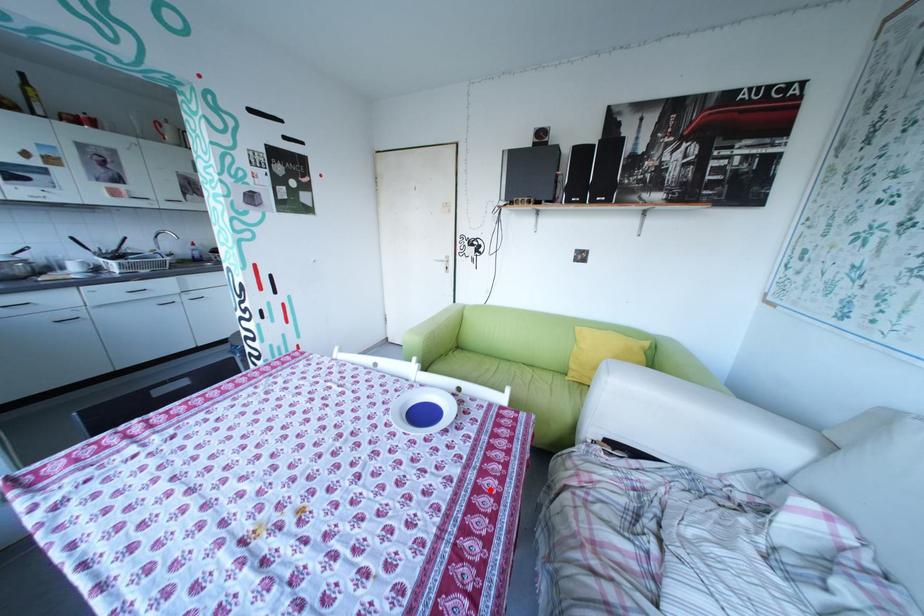
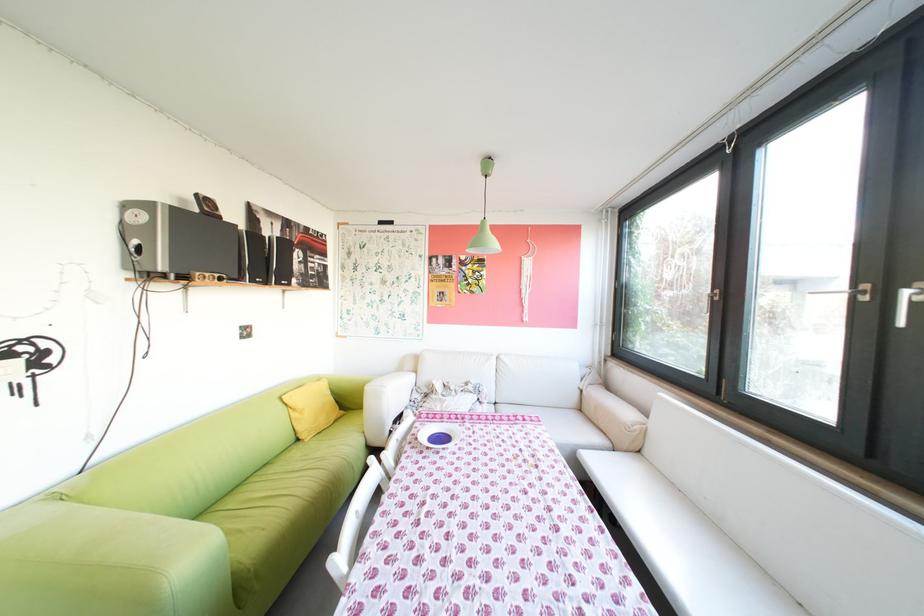
Question: I am providing you with two images of the same scene from different viewpoints. A red point is shown in image1. For the corresponding object point in image2, is it positioned nearer or farther from the camera?

Choices:
 (A) Nearer
 (B) Farther

Answer: (A)